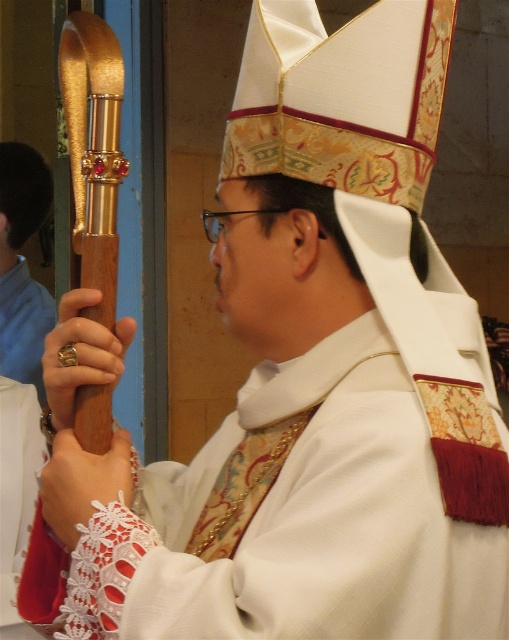
You are a photographer taking a picture of the bishop. You notice a point at coordinates (80, 353). Where is this point located in relation to the gold metallic ring at lower left?

The point at coordinates (80, 353) is located on the gold metallic ring at lower left.

You are an art student analyzing the image of a religious figure. You notice a point marked at coordinates (21, 264). Based on the scene description, what object is located at this point?

The point at (21, 264) marks the location of the gold polished staff at upper left.